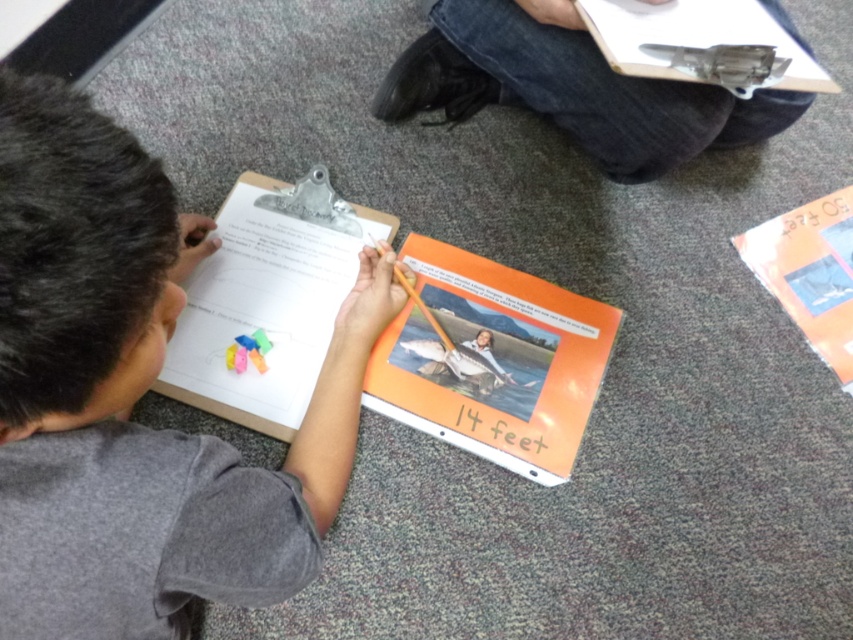
You are organizing a classroom and need to place both the orange matte book at center and the white paper clipboard at center on a shelf. If the shelf has limited space and you can only fit one of them, which item should you prioritize placing first based on their sizes?

The orange matte book at center is wider than the white paper clipboard at center, so you should prioritize placing the orange matte book at center first to ensure it fits on the shelf.

You need to place both the orange matte book at center and the white paper clipboard at center on a shelf. Which one should you place first to ensure the shorter item is on the bottom?

The orange matte book at center is shorter than the white paper clipboard at center, so you should place the white paper clipboard at center first to ensure the shorter item is on the bottom.